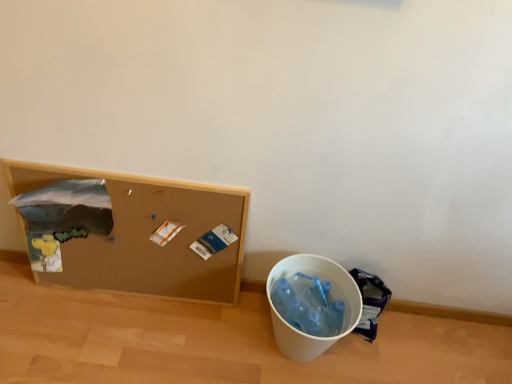
Question: From the image's perspective, is white plastic bucket at lower right above or below blue plastic bag at lower right?

Choices:
 (A) above
 (B) below

Answer: (B)

Question: From a real-world perspective, relative to blue plastic bag at lower right, is white plastic bucket at lower right vertically above or below?

Choices:
 (A) above
 (B) below

Answer: (A)

Question: Which of these objects is positioned farthest from the white plastic bucket at lower right?

Choices:
 (A) brown corkboard at left
 (B) blue plastic bag at lower right

Answer: (A)

Question: Which is nearer to the blue plastic bag at lower right?

Choices:
 (A) brown corkboard at left
 (B) white plastic bucket at lower right

Answer: (B)